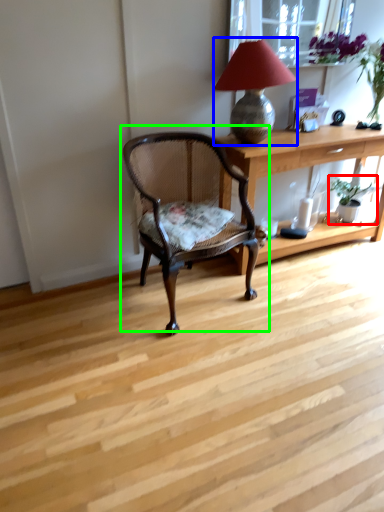
Question: Which is farther away from houseplant (highlighted by a red box)? lamp (highlighted by a blue box) or chair (highlighted by a green box)?

Choices:
 (A) lamp
 (B) chair

Answer: (B)